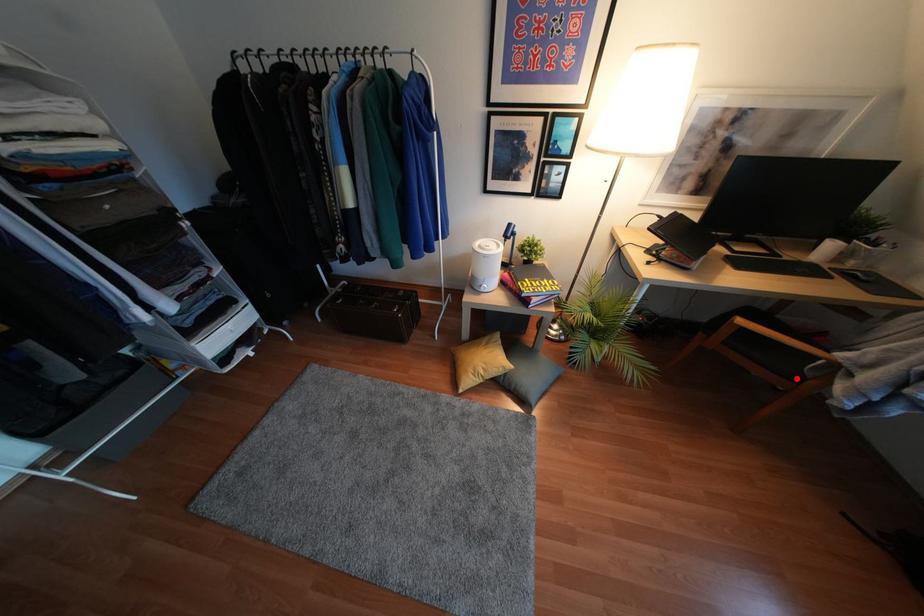
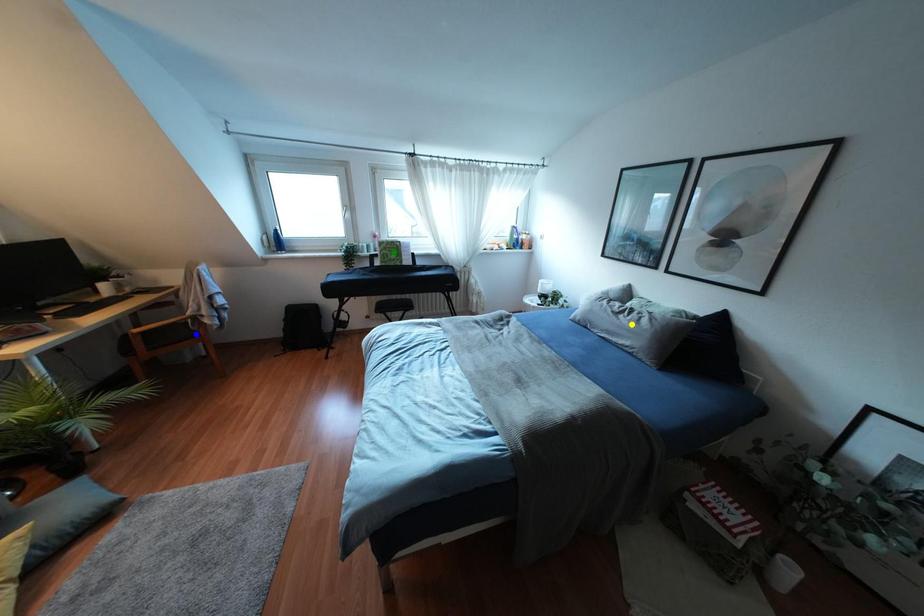
Question: I am providing you with two images of the same scene from different viewpoints. A red point is marked on the first image. You are given multiple points on the second image. Which mark in image 2 goes with the point in image 1?

Choices:
 (A) green point
 (B) yellow point
 (C) blue point

Answer: (C)